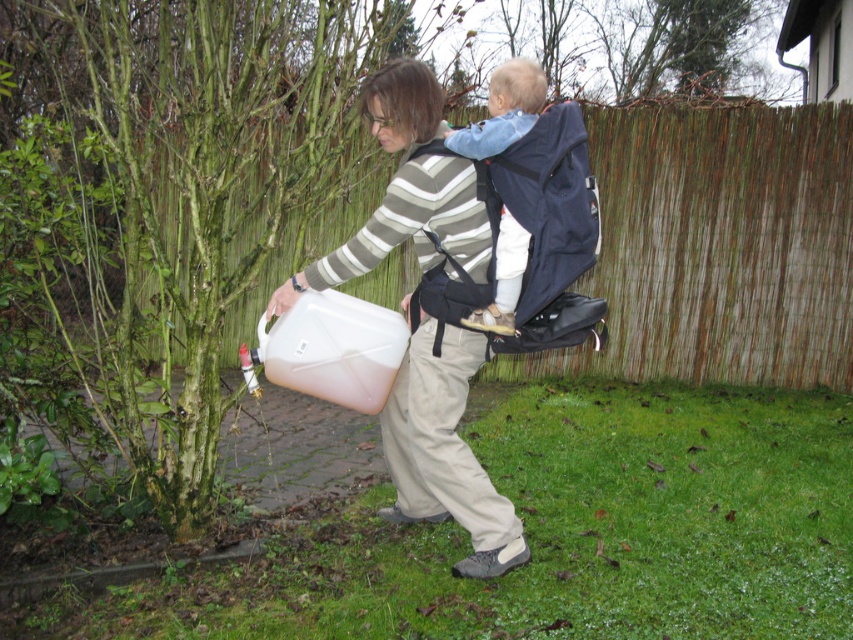
You are a gardener who needs to water a tree. You have a matte plastic container at center and a blue fabric carrier at center. Which object should you use to pour water onto the tree?

The matte plastic container at center is the correct tool for pouring water because it is designed to hold and pour liquids, unlike the blue fabric carrier at center which is meant for carrying a child.

You are standing in the backyard and want to water the tree. The point where you need to stand to be exactly 8 meters away from the tree is marked as point (397,257). Is the woman currently standing at that point?

The point (397,257) is 7.90 meters from viewer, so the woman is standing approximately 8 meters away from the tree. Therefore, yes, the woman is currently standing at that point.